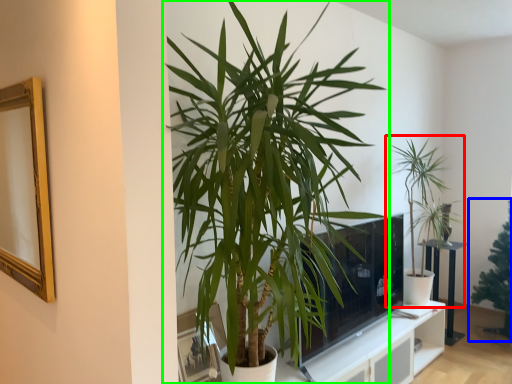
Question: Estimate the real-world distances between objects in this image. Which object is closer to houseplant (highlighted by a red box), houseplant (highlighted by a blue box) or houseplant (highlighted by a green box)?

Choices:
 (A) houseplant
 (B) houseplant

Answer: (A)